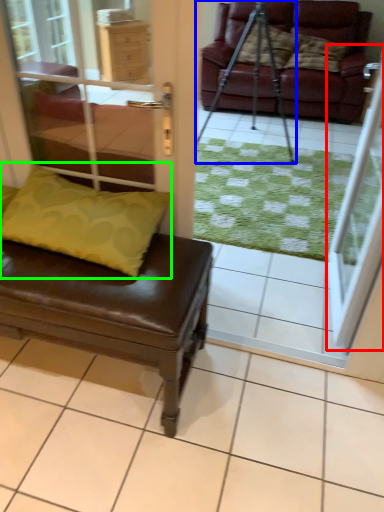
Question: Based on their relative distances, which object is nearer to screen door (highlighted by a red box)? Choose from tripod (highlighted by a blue box) and pillow (highlighted by a green box).

Choices:
 (A) tripod
 (B) pillow

Answer: (B)